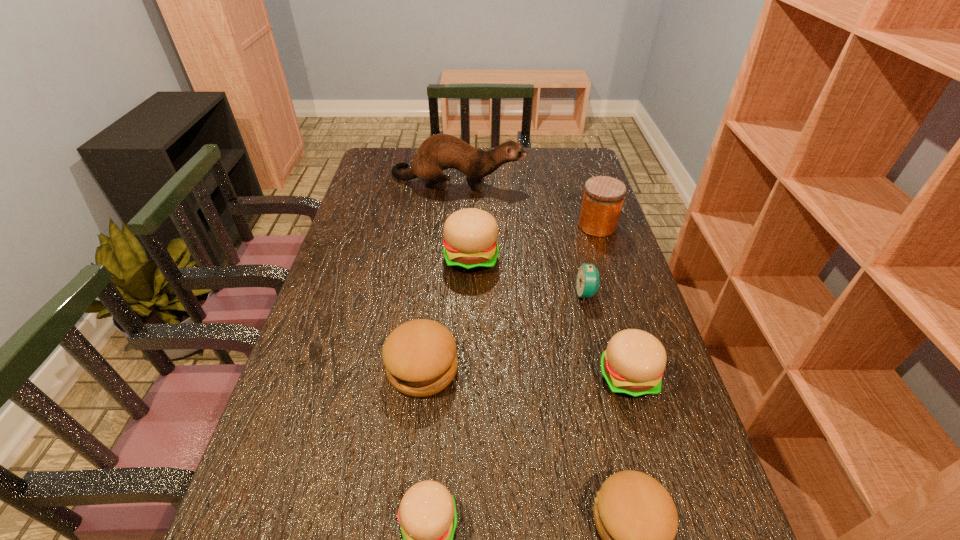
Locate which beige hamburger is the third closest to the alarm clock. Please provide its 2D coordinates. Your answer should be formatted as a tuple, i.e. [(x, y)], where the tuple contains the x and y coordinates of a point satisfying the conditions above.

[(427, 515)]

At what (x,y) coordinates should I click in order to perform the action: click on brown hamburger that stands as the second closest to the smallest beige hamburger. Please return your answer as a coordinate pair (x, y). Looking at the image, I should click on (635, 516).

Locate which brown hamburger is the closest to the smallest beige hamburger. Please provide its 2D coordinates. Your answer should be formatted as a tuple, i.e. [(x, y)], where the tuple contains the x and y coordinates of a point satisfying the conditions above.

[(420, 357)]

Locate an element on the screen. The image size is (960, 540). vacant area in the image that satisfies the following two spatial constraints: 1. on the front side of the rightmost beige hamburger; 2. on the left side of the farthest beige hamburger is located at coordinates (468, 377).